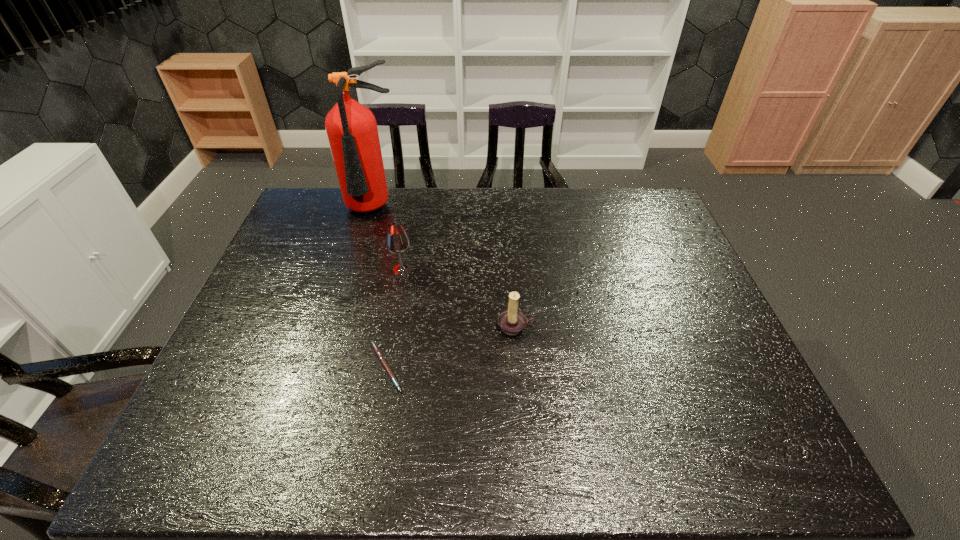
What are the coordinates of `fire extinguisher` in the screenshot? It's located at (351, 128).

At what (x,y) coordinates should I click in order to perform the action: click on the tallest object. Please return your answer as a coordinate pair (x, y). Looking at the image, I should click on (351, 128).

Locate an element on the screen. The height and width of the screenshot is (540, 960). wineglass is located at coordinates (397, 241).

Find the location of a particular element. Image resolution: width=960 pixels, height=540 pixels. the third farthest object is located at coordinates (512, 322).

Find the location of `candle holder`. candle holder is located at coordinates (512, 322).

Locate an element on the screen. pen is located at coordinates pyautogui.click(x=378, y=353).

You are a GUI agent. You are given a task and a screenshot of the screen. Output one action in this format:
    pyautogui.click(x=<x>, y=<y>)
    Task: Click on the shortest object
    The image size is (960, 540).
    Given the screenshot: What is the action you would take?
    pyautogui.click(x=378, y=353)

Where is `free space located 0.070m at the nozzle of the farthest object`? The image size is (960, 540). free space located 0.070m at the nozzle of the farthest object is located at coordinates (364, 245).

Locate an element on the screen. The image size is (960, 540). vacant region located on the right of the wineglass is located at coordinates (488, 269).

Where is `free space located 0.130m on the wick of the third tallest object`? This screenshot has height=540, width=960. free space located 0.130m on the wick of the third tallest object is located at coordinates (520, 382).